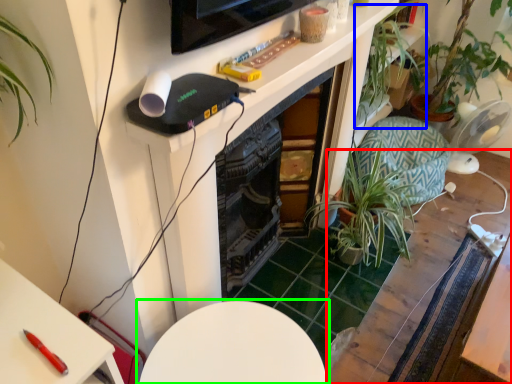
Question: Which object is positioned farthest from table (highlighted by a red box)? Select from vegetation (highlighted by a blue box) and table (highlighted by a green box).

Choices:
 (A) vegetation
 (B) table

Answer: (A)